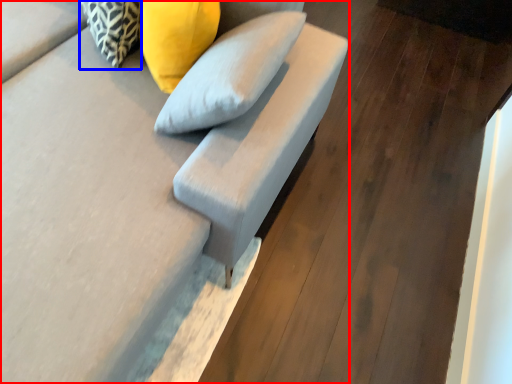
Question: Which point is further to the camera, furniture (highlighted by a red box) or pillow (highlighted by a blue box)?

Choices:
 (A) furniture
 (B) pillow

Answer: (B)